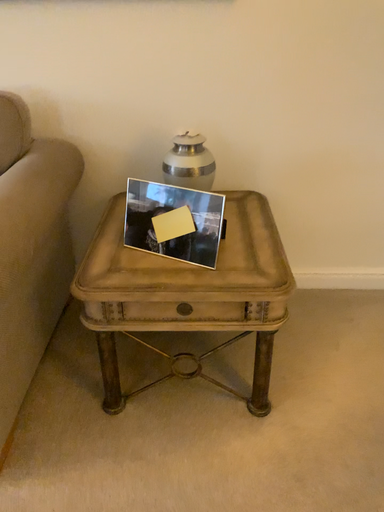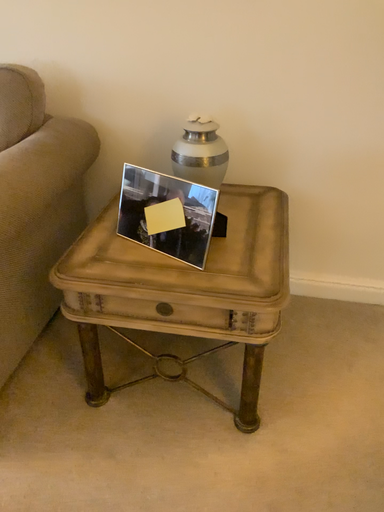
Question: Which way did the camera rotate in the video?

Choices:
 (A) rotated left
 (B) rotated right

Answer: (A)